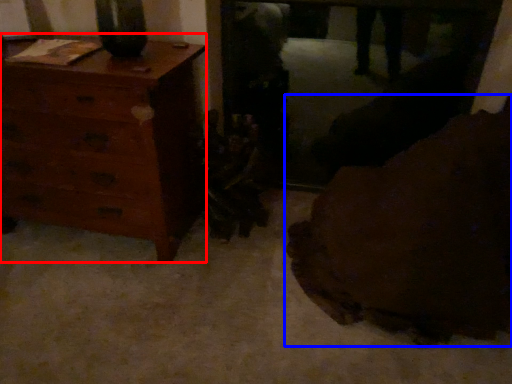
Question: Which object appears farthest to the camera in this image, chest of drawers (highlighted by a red box) or furniture (highlighted by a blue box)?

Choices:
 (A) chest of drawers
 (B) furniture

Answer: (A)